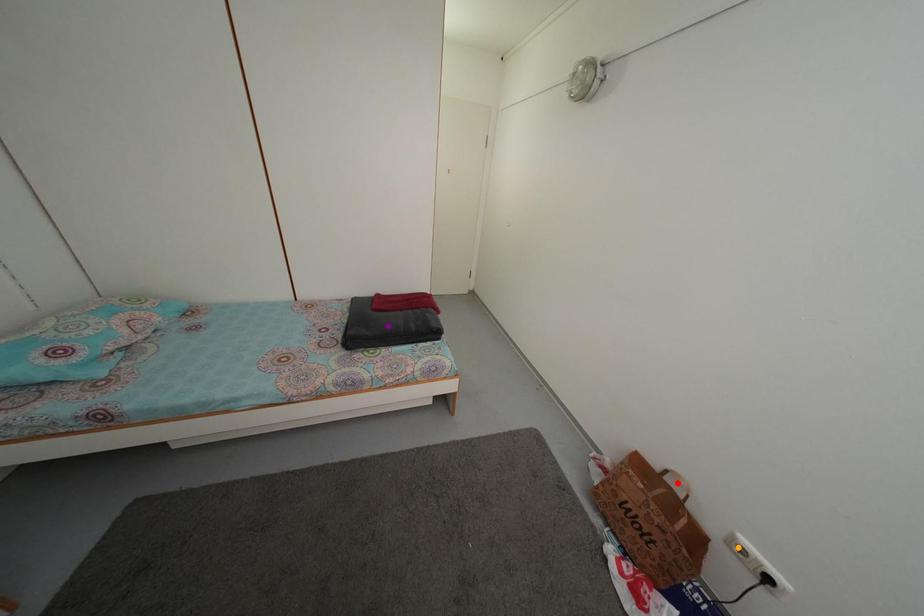
Order these from farthest to nearest:
- purple point
- orange point
- red point

purple point
red point
orange point